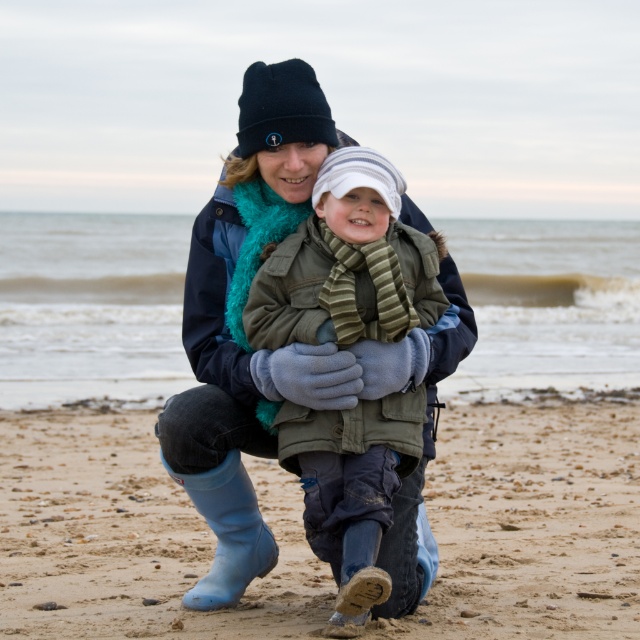
You are a photographer trying to capture the woman in the scene. You notice the striped knit hat at center and the rubber boots at lower left. Which object is closer to the right edge of the image?

The striped knit hat at center is positioned on the right side of the rubber boots at lower left, so it is closer to the right edge of the image.

You are standing on the beach and see the sandy brown at lower center and the rubber boots at lower left. Which object is wider?

The sandy brown at lower center is wider than the rubber boots at lower left.

You are a photographer trying to capture the striped knit hat at center and the rubber boots at lower left in a single shot. Since the camera can only focus on one object at a time, which object should you focus on to ensure the other remains in the background?

You should focus on the striped knit hat at center because it is in front of the rubber boots at lower left, so the rubber boots will naturally be in the background.